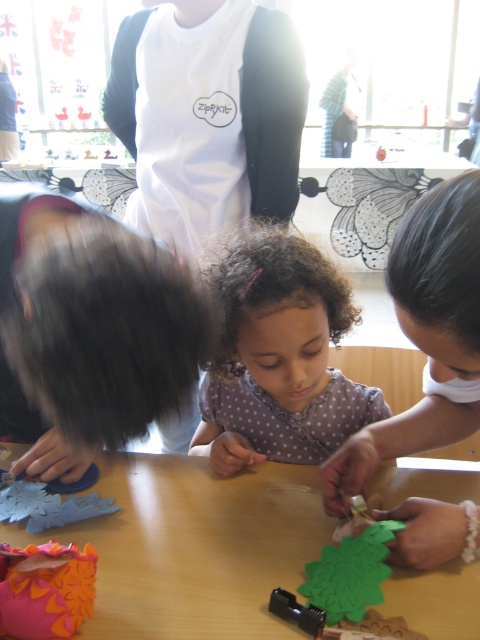
Question: In this image, where is wooden table at center located relative to polka dot fabric at center?

Choices:
 (A) above
 (B) below

Answer: (B)

Question: Which of the following is the farthest from the observer?

Choices:
 (A) polka dot fabric at center
 (B) wooden table at center

Answer: (A)

Question: Among these objects, which one is nearest to the camera?

Choices:
 (A) dark brown smooth hair at upper center
 (B) wooden table at center

Answer: (A)

Question: Observing the image, what is the correct spatial positioning of curly brown hair at center in reference to dark brown smooth hair at upper center?

Choices:
 (A) left
 (B) right

Answer: (A)

Question: Observing the image, what is the correct spatial positioning of curly brown hair at center in reference to dark brown smooth hair at upper center?

Choices:
 (A) below
 (B) above

Answer: (B)

Question: Which object is closer to the camera taking this photo?

Choices:
 (A) polka dot fabric at center
 (B) dark brown smooth hair at upper center
 (C) dark brown curly hair at left

Answer: (B)